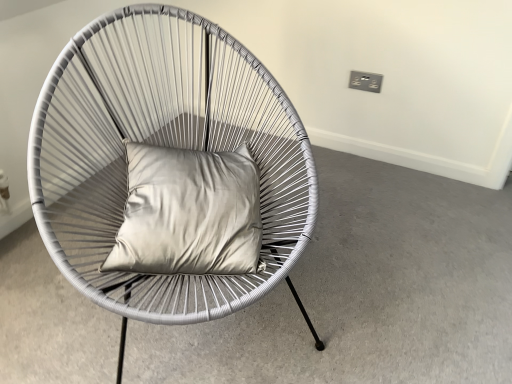
Question: Does point (103, 281) appear closer or farther from the camera than point (89, 375)?

Choices:
 (A) closer
 (B) farther

Answer: (A)

Question: Is white woven chair at center in front of or behind matte white chair at center in the image?

Choices:
 (A) front
 (B) behind

Answer: (A)

Question: Which object is the closest to the white woven chair at center?

Choices:
 (A) matte white chair at center
 (B) satin silver pillow at center

Answer: (B)

Question: Which object is the closest to the white woven chair at center?

Choices:
 (A) satin silver pillow at center
 (B) matte white chair at center

Answer: (A)